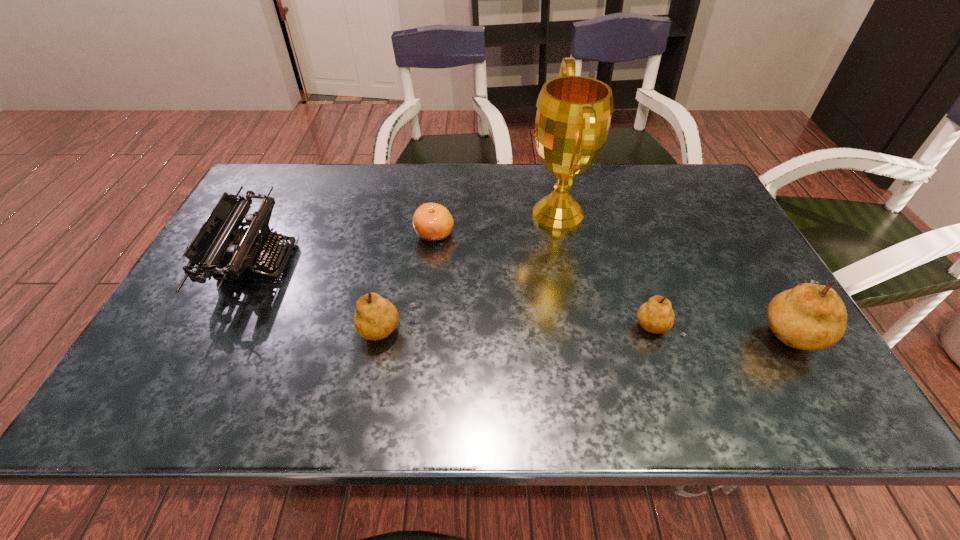
Where is `pear that is the closest to the leftmost object`? This screenshot has width=960, height=540. pear that is the closest to the leftmost object is located at coordinates (376, 318).

Where is `pear that is the second nearest to the fifth shortest object`? The width and height of the screenshot is (960, 540). pear that is the second nearest to the fifth shortest object is located at coordinates tap(376, 318).

Identify the location of free location that satisfies the following two spatial constraints: 1. on the front-facing side of the award; 2. on the front side of the shortest object. This screenshot has height=540, width=960. (562, 234).

This screenshot has height=540, width=960. Find the location of `free location that satisfies the following two spatial constraints: 1. on the front side of the shortest object; 2. on the left side of the second pear from right to left`. free location that satisfies the following two spatial constraints: 1. on the front side of the shortest object; 2. on the left side of the second pear from right to left is located at coordinates (424, 330).

Find the location of a particular element. The width and height of the screenshot is (960, 540). free space that satisfies the following two spatial constraints: 1. on the typing side of the leftmost object; 2. on the back side of the tallest pear is located at coordinates (222, 329).